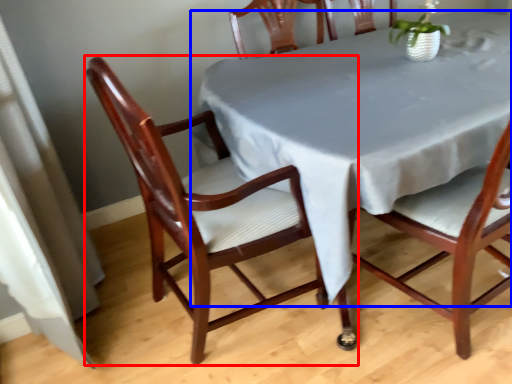
Question: Among these objects, which one is farthest to the camera, chair (highlighted by a red box) or table (highlighted by a blue box)?

Choices:
 (A) chair
 (B) table

Answer: (B)